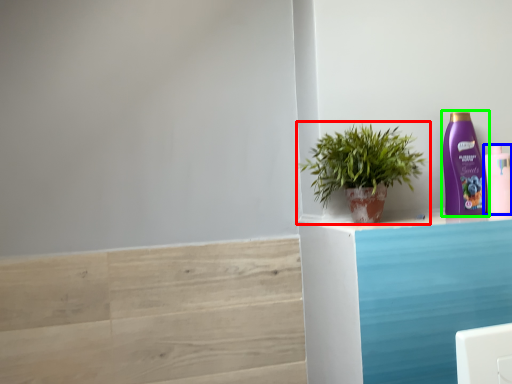
Question: Considering the real-world distances, which object is closest to houseplant (highlighted by a red box)? bottle (highlighted by a blue box) or bottle (highlighted by a green box).

Choices:
 (A) bottle
 (B) bottle

Answer: (B)